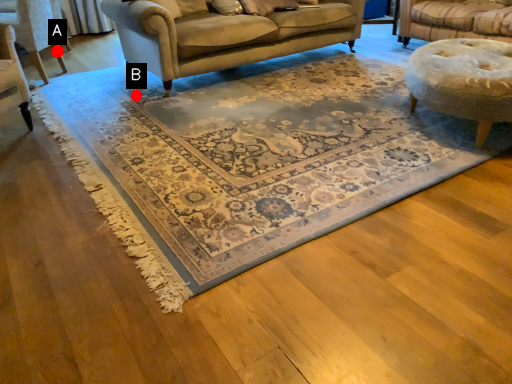
Question: Two points are circled on the image, labeled by A and B beside each circle. Which of the following is the farthest from the observer?

Choices:
 (A) A is further
 (B) B is further

Answer: (A)